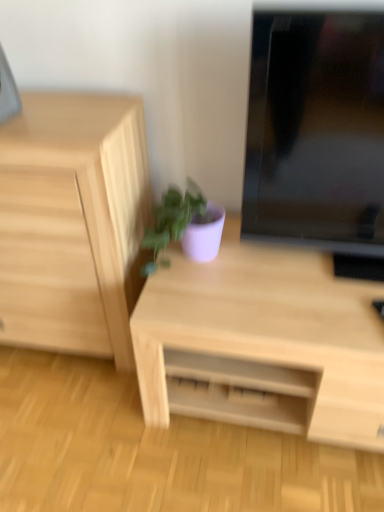
Question: Does light wood desk at center appear on the left side of matte purple pot at center?

Choices:
 (A) yes
 (B) no

Answer: (B)

Question: Is light wood desk at center positioned before matte purple pot at center?

Choices:
 (A) no
 (B) yes

Answer: (B)

Question: Is light wood desk at center oriented towards matte purple pot at center?

Choices:
 (A) no
 (B) yes

Answer: (A)

Question: From a real-world perspective, is light wood desk at center below matte purple pot at center?

Choices:
 (A) yes
 (B) no

Answer: (A)

Question: Does light wood desk at center have a smaller size compared to matte purple pot at center?

Choices:
 (A) no
 (B) yes

Answer: (A)

Question: Looking at their shapes, would you say black glossy monitor at upper right is wider or thinner than matte purple pot at center?

Choices:
 (A) wide
 (B) thin

Answer: (A)

Question: Looking at the image, does black glossy monitor at upper right seem bigger or smaller compared to matte purple pot at center?

Choices:
 (A) big
 (B) small

Answer: (A)

Question: Considering the positions of black glossy monitor at upper right and matte purple pot at center in the image, is black glossy monitor at upper right taller or shorter than matte purple pot at center?

Choices:
 (A) short
 (B) tall

Answer: (B)

Question: Is point (334, 59) closer or farther from the camera than point (196, 205)?

Choices:
 (A) farther
 (B) closer

Answer: (B)

Question: In terms of width, does matte purple pot at center look wider or thinner when compared to light wood chest of drawers at left?

Choices:
 (A) thin
 (B) wide

Answer: (A)

Question: In terms of size, does matte purple pot at center appear bigger or smaller than light wood chest of drawers at left?

Choices:
 (A) small
 (B) big

Answer: (A)

Question: Would you say matte purple pot at center is inside or outside light wood chest of drawers at left?

Choices:
 (A) inside
 (B) outside

Answer: (B)

Question: Considering the relative positions of matte purple pot at center and light wood chest of drawers at left in the image provided, is matte purple pot at center to the left or to the right of light wood chest of drawers at left?

Choices:
 (A) right
 (B) left

Answer: (A)

Question: Is light wood chest of drawers at left situated inside matte purple pot at center or outside?

Choices:
 (A) outside
 (B) inside

Answer: (A)

Question: Considering the positions of light wood chest of drawers at left and matte purple pot at center in the image, is light wood chest of drawers at left bigger or smaller than matte purple pot at center?

Choices:
 (A) big
 (B) small

Answer: (A)